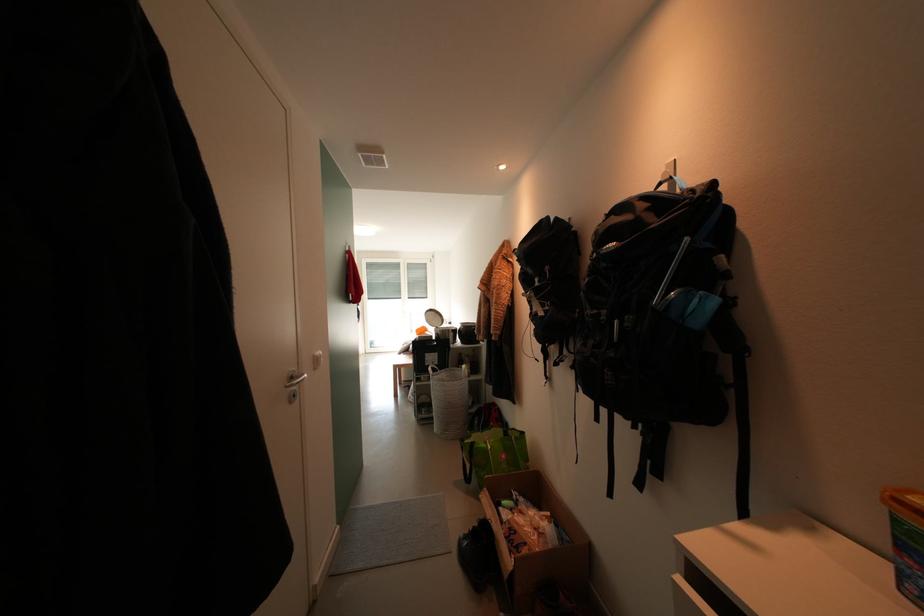
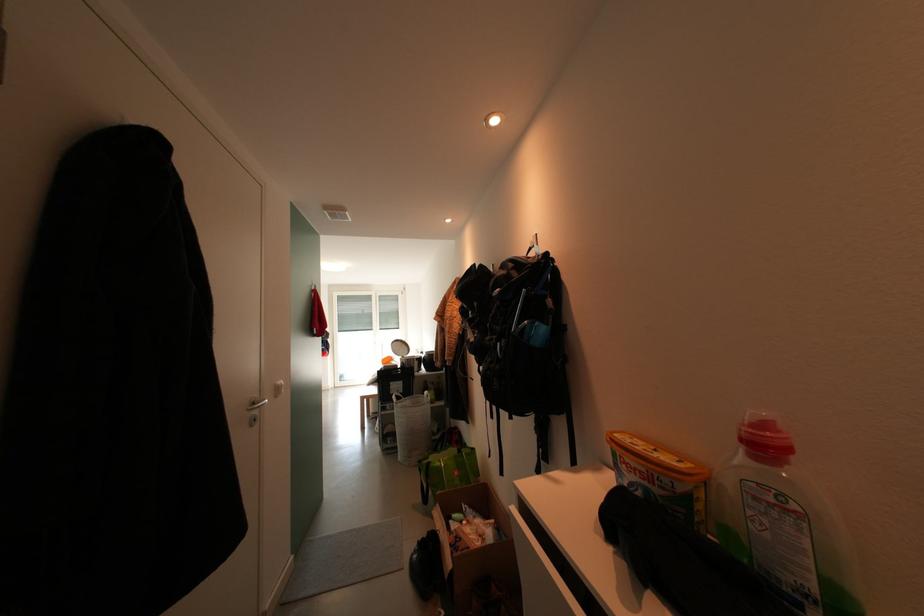
Where in the second image is the point corresponding to point (403, 370) from the first image?

(371, 400)